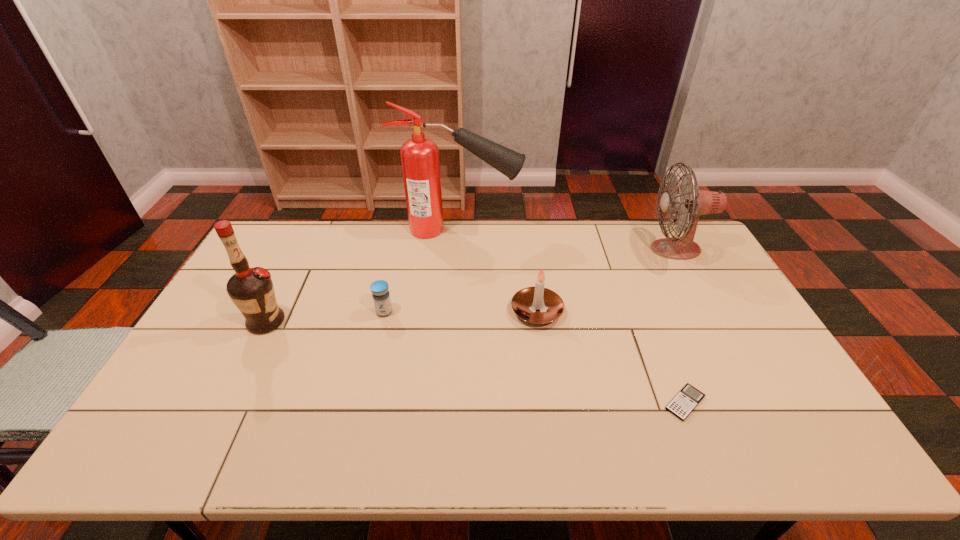
Locate an element on the screen. This screenshot has width=960, height=540. vacant region at the far edge of the desktop is located at coordinates (472, 221).

I want to click on free space at the near edge of the desktop, so click(x=291, y=435).

In the image, there is a desktop. What are the coordinates of `vacant space at the left edge` in the screenshot? It's located at (191, 410).

The image size is (960, 540). Find the location of `free space at the right edge`. free space at the right edge is located at coordinates (753, 374).

In the image, there is a desktop. At what (x,y) coordinates should I click in order to perform the action: click on vacant space at the near left corner. Please return your answer as a coordinate pair (x, y). This screenshot has width=960, height=540. Looking at the image, I should click on (180, 460).

Find the location of a particular element. free region at the near right corner of the desktop is located at coordinates (759, 442).

Find the location of a particular element. empty location between the calculator and the medicine is located at coordinates (535, 357).

Find the location of a particular element. The height and width of the screenshot is (540, 960). free space between the rightmost object and the candle is located at coordinates (606, 280).

Where is `vacant point located between the shortest object and the third shortest object`? This screenshot has width=960, height=540. vacant point located between the shortest object and the third shortest object is located at coordinates (611, 357).

Find the location of a particular element. The height and width of the screenshot is (540, 960). empty space that is in between the candle and the fire extinguisher is located at coordinates (498, 271).